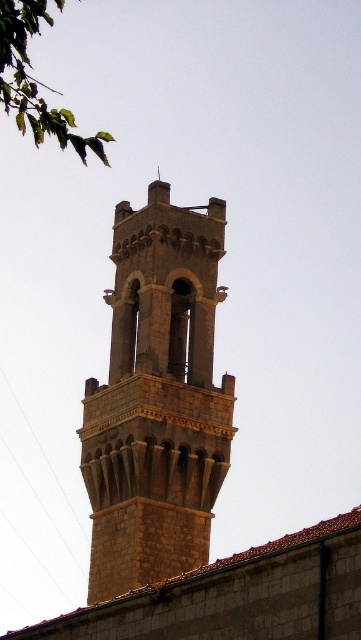
Question: Among these points, which one is nearest to the camera?

Choices:
 (A) (38, 16)
 (B) (158, 300)

Answer: (A)

Question: In this image, where is stone tower at center located relative to green leafy branch at upper left?

Choices:
 (A) right
 (B) left

Answer: (A)

Question: Can you confirm if stone tower at center is positioned above green leafy branch at upper left?

Choices:
 (A) yes
 (B) no

Answer: (B)

Question: Which point is farther to the camera?

Choices:
 (A) stone tower at center
 (B) green leafy branch at upper left

Answer: (A)

Question: Among these points, which one is nearest to the camera?

Choices:
 (A) (88, 442)
 (B) (31, 88)

Answer: (B)

Question: Is stone tower at center above green leafy branch at upper left?

Choices:
 (A) yes
 (B) no

Answer: (B)